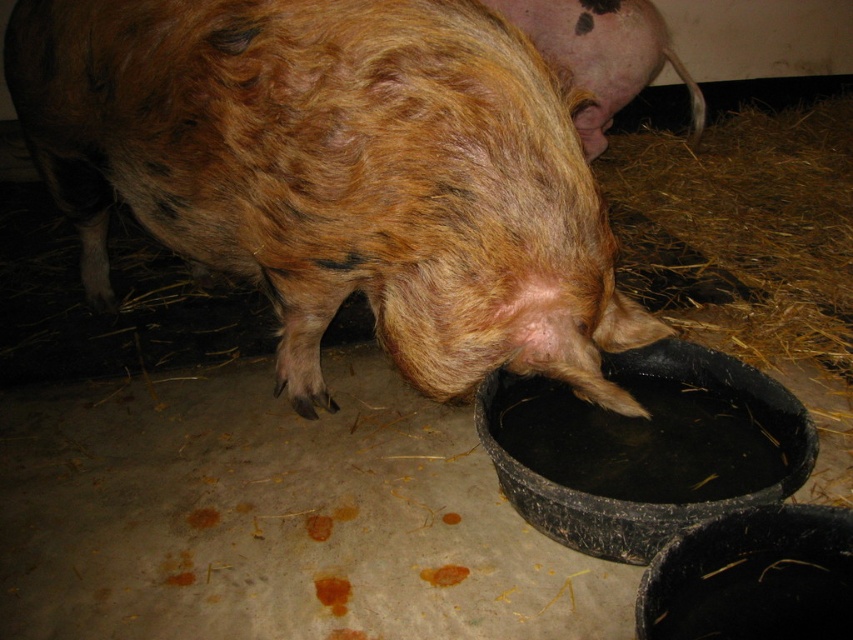
Question: Which point is farther to the camera?

Choices:
 (A) (21, 12)
 (B) (566, 8)

Answer: (B)

Question: Does brown furry pig at center lie behind pink soft skin at upper right?

Choices:
 (A) no
 (B) yes

Answer: (A)

Question: Does brown furry pig at center have a larger size compared to pink soft skin at upper right?

Choices:
 (A) yes
 (B) no

Answer: (A)

Question: Where is brown furry pig at center located in relation to pink soft skin at upper right in the image?

Choices:
 (A) right
 (B) left

Answer: (B)